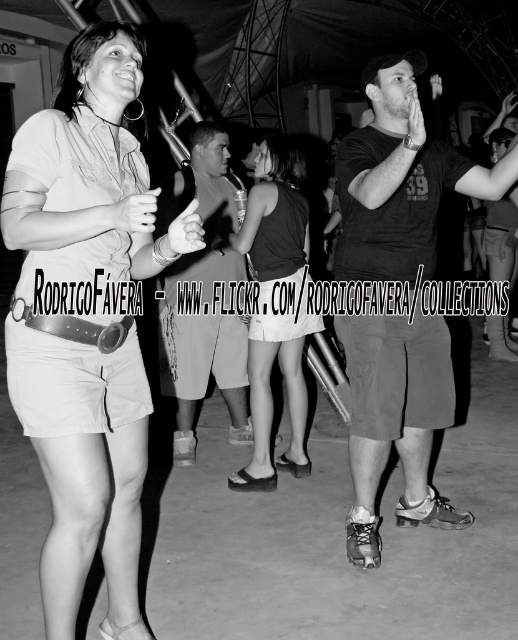
Can you confirm if matte khaki shorts at left is positioned to the right of smooth gray shorts at center?

Incorrect, matte khaki shorts at left is not on the right side of smooth gray shorts at center.

Who is higher up, matte khaki shorts at left or smooth gray shorts at center?

smooth gray shorts at center is higher up.

Measure the distance between matte khaki shorts at left and camera.

They are 1.76 meters apart.

This screenshot has height=640, width=518. In order to click on matte khaki shorts at left in this screenshot , I will do `click(89, 176)`.

Who is higher up, dark gray cotton t-shirt at center or smooth gray shorts at center?

Positioned higher is smooth gray shorts at center.

Does point (407, 516) come in front of point (218, 250)?

Yes, point (407, 516) is in front of point (218, 250).

You are a GUI agent. You are given a task and a screenshot of the screen. Output one action in this format:
    pyautogui.click(x=<x>, y=<y>)
    Task: Click on the dark gray cotton t-shirt at center
    This screenshot has width=518, height=640.
    Given the screenshot: What is the action you would take?
    click(400, 179)

At what (x,y) coordinates should I click in order to perform the action: click on dark gray cotton t-shirt at center. Please return your answer as a coordinate pair (x, y). The height and width of the screenshot is (640, 518). Looking at the image, I should click on (400, 179).

Between matte khaki shorts at left and dark gray cotton t-shirt at center, which one is positioned lower?

matte khaki shorts at left is lower down.

Is matte khaki shorts at left above dark gray cotton t-shirt at center?

Incorrect, matte khaki shorts at left is not positioned above dark gray cotton t-shirt at center.

Where is `matte khaki shorts at left`? matte khaki shorts at left is located at coordinates (89, 176).